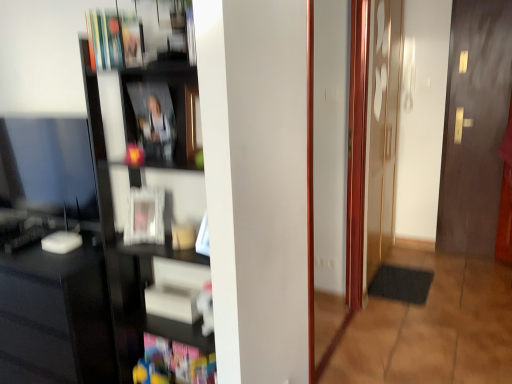
Question: Is hardcover book at upper left, placed as the 1th book when sorted from top to bottom, positioned with its back to dark wood door at right?

Choices:
 (A) yes
 (B) no

Answer: (A)

Question: Is hardcover book at upper left, placed as the 1th book when sorted from top to bottom, aimed at dark wood door at right?

Choices:
 (A) yes
 (B) no

Answer: (B)

Question: Can you confirm if hardcover book at upper left, the seventh book positioned from the bottom, is smaller than dark wood door at right?

Choices:
 (A) yes
 (B) no

Answer: (A)

Question: Can you confirm if hardcover book at upper left, the seventh book positioned from the bottom, is taller than dark wood door at right?

Choices:
 (A) yes
 (B) no

Answer: (B)

Question: Is hardcover book at upper left, the seventh book positioned from the bottom, located outside dark wood door at right?

Choices:
 (A) yes
 (B) no

Answer: (A)

Question: In terms of size, does black glossy computer desk at left appear bigger or smaller than matte black book at center, which is the fourth book in top-to-bottom order?

Choices:
 (A) big
 (B) small

Answer: (A)

Question: In the image, is black glossy computer desk at left on the left side or the right side of matte black book at center, which appears as the 4th book when ordered from the bottom?

Choices:
 (A) left
 (B) right

Answer: (A)

Question: Is black glossy computer desk at left in front of or behind matte black book at center, which is the fourth book in top-to-bottom order, in the image?

Choices:
 (A) behind
 (B) front

Answer: (B)

Question: Is black glossy computer desk at left spatially inside matte black book at center, which appears as the 4th book when ordered from the bottom, or outside of it?

Choices:
 (A) outside
 (B) inside

Answer: (A)

Question: Does point (168, 248) appear closer or farther from the camera than point (144, 208)?

Choices:
 (A) farther
 (B) closer

Answer: (A)

Question: Looking at the image, does black glossy shelf at left seem bigger or smaller compared to matte white photo frame at center, positioned as the 5th book in top-to-bottom order?

Choices:
 (A) big
 (B) small

Answer: (A)

Question: Looking at their shapes, would you say black glossy shelf at left is wider or thinner than matte white photo frame at center, positioned as the 5th book in top-to-bottom order?

Choices:
 (A) wide
 (B) thin

Answer: (A)

Question: From the image's perspective, relative to matte white photo frame at center, positioned as the 5th book in top-to-bottom order, is black glossy shelf at left above or below?

Choices:
 (A) above
 (B) below

Answer: (B)

Question: Is hardcover book at upper left, positioned as the second book in top-to-bottom order, wider or thinner than dark wood door at right?

Choices:
 (A) wide
 (B) thin

Answer: (A)

Question: From a real-world perspective, is hardcover book at upper left, the sixth book when ordered from bottom to top, positioned above or below dark wood door at right?

Choices:
 (A) below
 (B) above

Answer: (B)